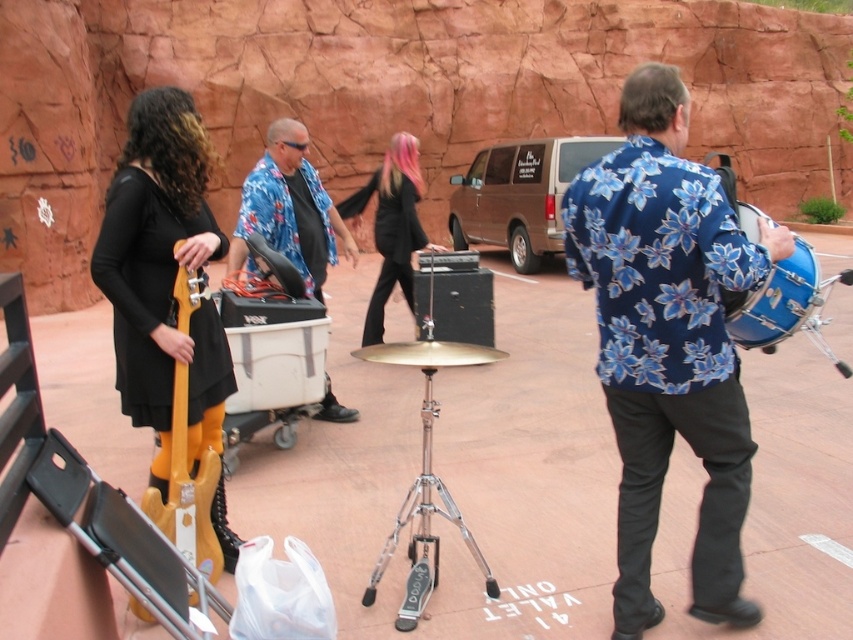
Question: Among these points, which one is farthest from the camera?

Choices:
 (A) (190, 497)
 (B) (256, 163)
 (C) (820, 323)
 (D) (399, 280)

Answer: (B)

Question: From the image, what is the correct spatial relationship of black glossy guitar at center in relation to blue metallic drum at right?

Choices:
 (A) right
 (B) left

Answer: (B)

Question: Can you confirm if blue floral shirt at center is positioned below blue metallic drum at right?

Choices:
 (A) no
 (B) yes

Answer: (B)

Question: Which of the following is the farthest from the observer?

Choices:
 (A) (709, 278)
 (B) (154, 486)

Answer: (B)

Question: Can you confirm if floral fabric shirt at center is bigger than blue metallic drum at right?

Choices:
 (A) no
 (B) yes

Answer: (B)

Question: Among these objects, which one is farthest from the camera?

Choices:
 (A) blue metallic drum at right
 (B) wooden electric guitar at left
 (C) blue floral shirt at center
 (D) floral fabric shirt at center

Answer: (D)